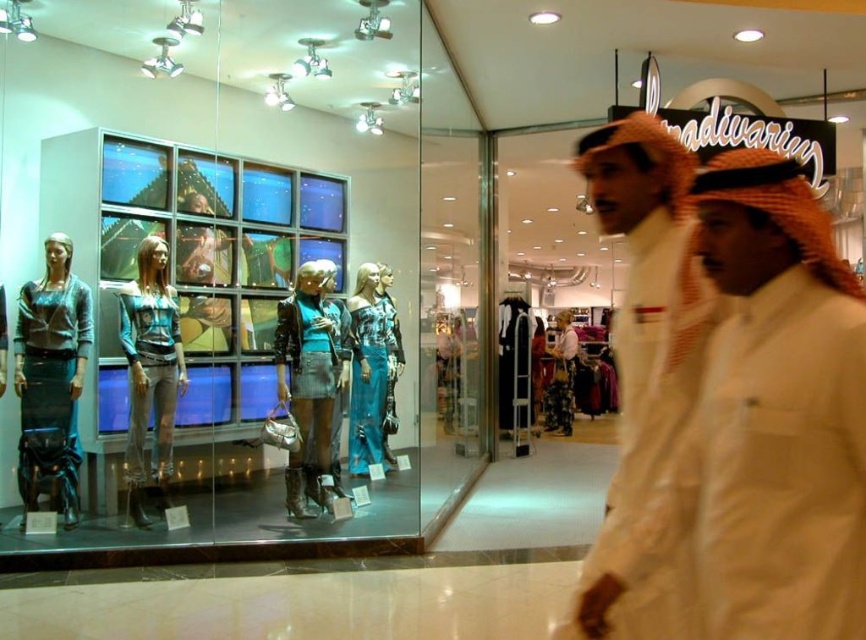
Who is higher up, metallic blue dress at left or matte teal fabric dress at center?

metallic blue dress at left is higher up.

Who is positioned more to the left, metallic blue dress at left or matte teal fabric dress at center?

From the viewer's perspective, metallic blue dress at left appears more on the left side.

This screenshot has width=866, height=640. What are the coordinates of `metallic blue dress at left` in the screenshot? It's located at (50, 381).

Is metallic silver boots at center closer to the viewer compared to matte teal fabric dress at center?

No, metallic silver boots at center is further to the viewer.

Who is more forward, (304, 332) or (150, 340)?

Point (150, 340) is more forward.

Who is more distant from viewer, (x=301, y=342) or (x=167, y=404)?

Point (x=301, y=342)

This screenshot has width=866, height=640. In order to click on metallic silver boots at center in this screenshot , I will do `click(309, 381)`.

Between metallic blue dress at left and metallic silver boots at center, which one has more height?

With more height is metallic blue dress at left.

Which is behind, point (44, 285) or point (315, 344)?

The point (315, 344) is behind.

This screenshot has width=866, height=640. I want to click on metallic blue dress at left, so click(50, 381).